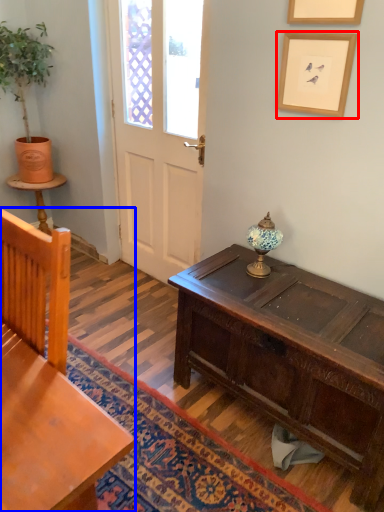
Question: Which object appears farthest to the camera in this image, picture frame (highlighted by a red box) or chair (highlighted by a blue box)?

Choices:
 (A) picture frame
 (B) chair

Answer: (A)